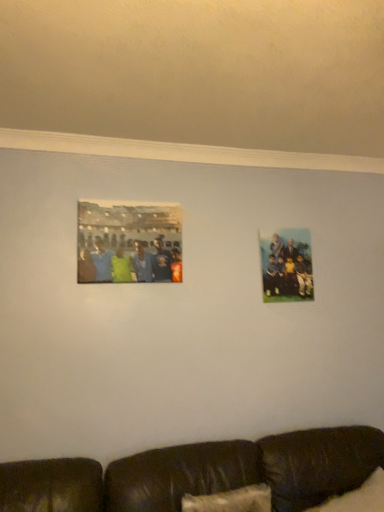
Question: Can you confirm if white fluffy pillow at lower right is bigger than brown leather couch at lower center?

Choices:
 (A) yes
 (B) no

Answer: (B)

Question: Considering the relative positions of white fluffy pillow at lower right and brown leather couch at lower center in the image provided, is white fluffy pillow at lower right to the right of brown leather couch at lower center from the viewer's perspective?

Choices:
 (A) no
 (B) yes

Answer: (B)

Question: Does white fluffy pillow at lower right have a lesser width compared to brown leather couch at lower center?

Choices:
 (A) yes
 (B) no

Answer: (A)

Question: Does white fluffy pillow at lower right have a smaller size compared to brown leather couch at lower center?

Choices:
 (A) no
 (B) yes

Answer: (B)

Question: From a real-world perspective, is white fluffy pillow at lower right under brown leather couch at lower center?

Choices:
 (A) no
 (B) yes

Answer: (A)

Question: From a real-world perspective, is white fluffy pillow at lower right located higher than brown leather couch at lower center?

Choices:
 (A) no
 (B) yes

Answer: (B)

Question: From a real-world perspective, does matte plastic photo frame at upper left, placed as the 1th picture frame when sorted from left to right, sit lower than matte plastic photo frame at right, acting as the 1th picture frame starting from the right?

Choices:
 (A) yes
 (B) no

Answer: (B)

Question: Is matte plastic photo frame at upper left, placed as the 1th picture frame when sorted from left to right, positioned beyond the bounds of matte plastic photo frame at right, the first picture frame from the back?

Choices:
 (A) yes
 (B) no

Answer: (A)

Question: From the image's perspective, is matte plastic photo frame at upper left, which appears as the second picture frame when viewed from the back, located above matte plastic photo frame at right, the first picture frame from the back?

Choices:
 (A) no
 (B) yes

Answer: (B)

Question: Is matte plastic photo frame at upper left, the 2th picture frame viewed from the right, touching matte plastic photo frame at right, the second picture frame viewed from the left?

Choices:
 (A) no
 (B) yes

Answer: (A)

Question: Is matte plastic photo frame at upper left, which appears as the second picture frame when viewed from the back, oriented towards matte plastic photo frame at right, acting as the 1th picture frame starting from the right?

Choices:
 (A) yes
 (B) no

Answer: (B)

Question: From the image's perspective, does matte plastic photo frame at upper left, the first picture frame positioned from the front, appear lower than matte plastic photo frame at right, acting as the 1th picture frame starting from the right?

Choices:
 (A) yes
 (B) no

Answer: (B)

Question: Is matte plastic photo frame at upper left, which appears as the second picture frame when viewed from the back, in front of brown leather couch at lower center?

Choices:
 (A) no
 (B) yes

Answer: (A)